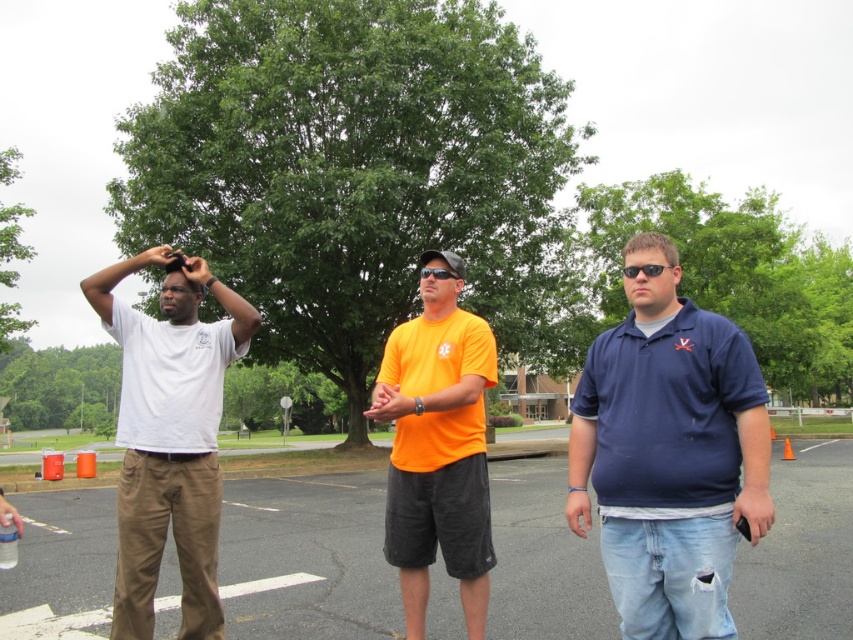
Question: Among these objects, which one is farthest from the camera?

Choices:
 (A) navy blue polo shirt at right
 (B) white matte t-shirt at left

Answer: (B)

Question: Which point is farther to the camera?

Choices:
 (A) 834,547
 (B) 660,280

Answer: (A)

Question: Is white matte t-shirt at left in front of orange matte t-shirt at center?

Choices:
 (A) yes
 (B) no

Answer: (B)

Question: Which of the following is the farthest from the observer?

Choices:
 (A) navy blue polo shirt at right
 (B) white matte t-shirt at left

Answer: (B)

Question: Considering the relative positions of navy blue polo shirt at right and orange matte t-shirt at center in the image provided, where is navy blue polo shirt at right located with respect to orange matte t-shirt at center?

Choices:
 (A) below
 (B) above

Answer: (A)

Question: Does asphalt at center have a greater width compared to orange matte t-shirt at center?

Choices:
 (A) no
 (B) yes

Answer: (B)